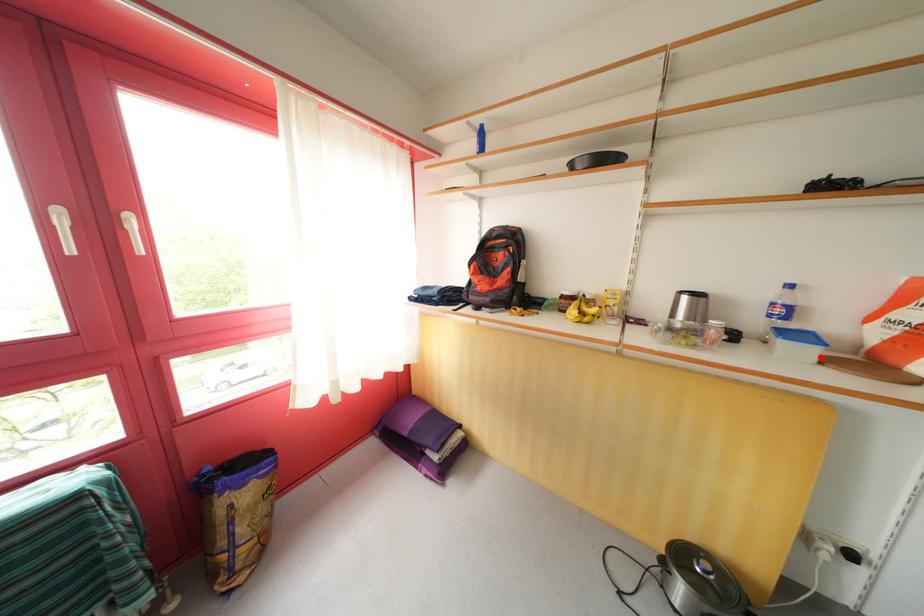
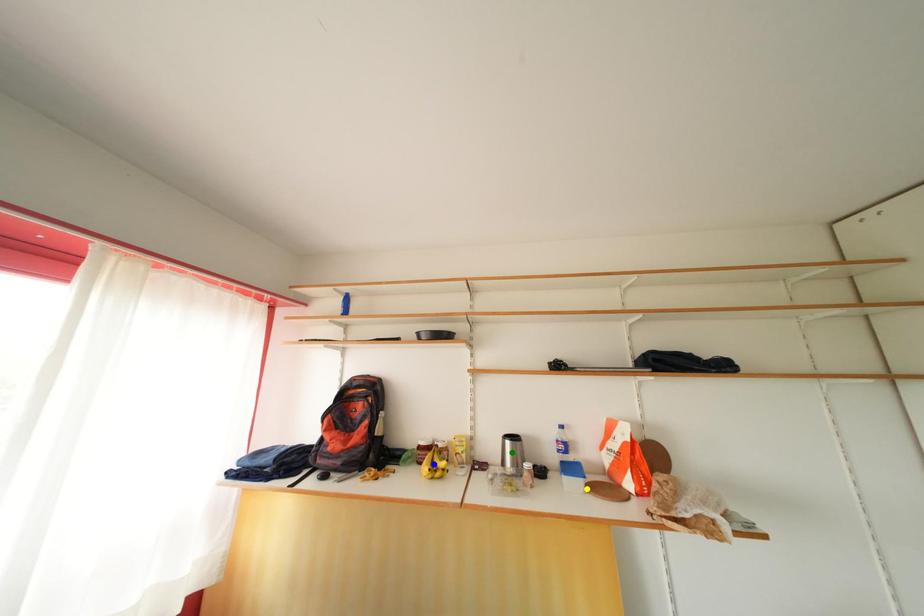
Question: I am providing you with two images of the same scene from different viewpoints. A red point is marked on the first image. You are given multiple points on the second image. In image 2, which mark is for the same physical point as the one in image 1?

Choices:
 (A) green point
 (B) blue point
 (C) yellow point

Answer: (C)